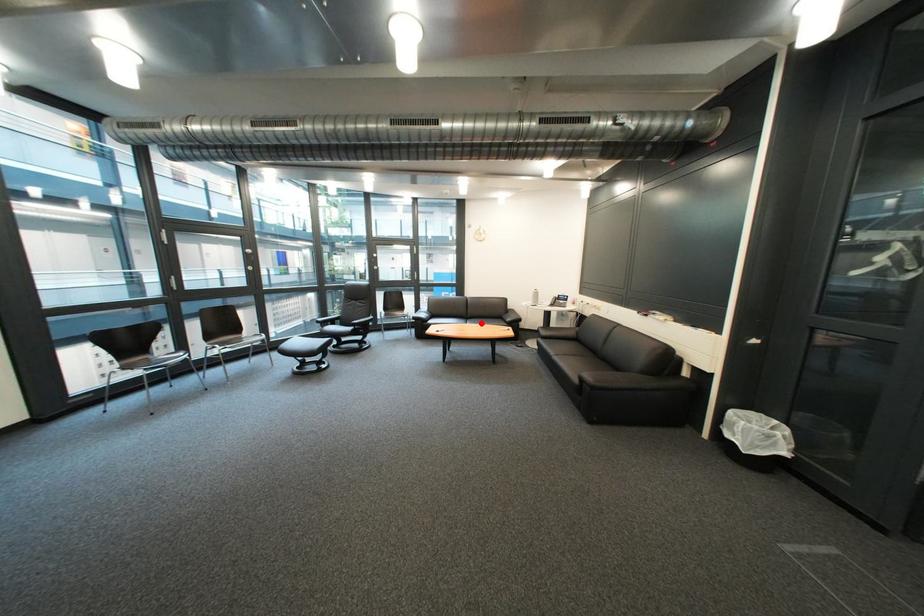
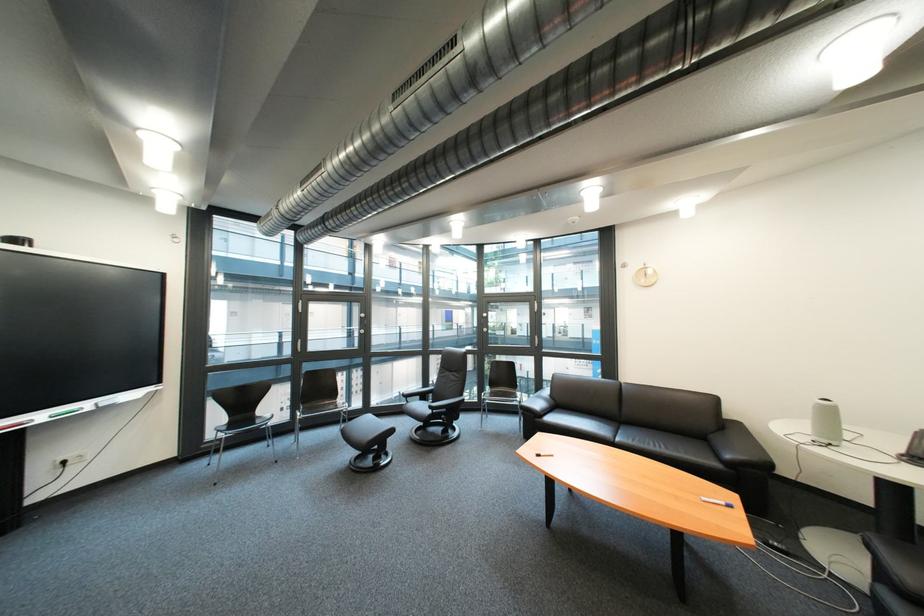
Find the pixel in the second image that matches the highlighted location in the first image.

(634, 434)